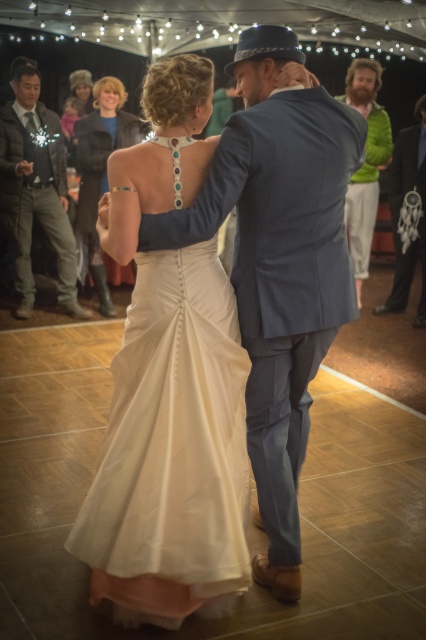
Between point (71, 268) and point (371, 72), which one is positioned behind?

Positioned behind is point (371, 72).

Can you confirm if dark green jacket at left is smaller than green fuzzy sweater at upper right?

Indeed, dark green jacket at left has a smaller size compared to green fuzzy sweater at upper right.

Image resolution: width=426 pixels, height=640 pixels. I want to click on dark green jacket at left, so click(36, 189).

You are a GUI agent. You are given a task and a screenshot of the screen. Output one action in this format:
    pyautogui.click(x=<x>, y=<y>)
    Task: Click on the dark green jacket at left
    
    Given the screenshot: What is the action you would take?
    pyautogui.click(x=36, y=189)

Who is positioned more to the left, ivory satin dress at center or green fuzzy sweater at upper right?

From the viewer's perspective, ivory satin dress at center appears more on the left side.

Is ivory satin dress at center bigger than green fuzzy sweater at upper right?

Actually, ivory satin dress at center might be smaller than green fuzzy sweater at upper right.

Is point (89, 132) more distant than point (367, 141)?

Yes, point (89, 132) is behind point (367, 141).

Identify the location of ivory satin dress at center. This screenshot has height=640, width=426. (100, 172).

Is point (49, 204) closer to viewer compared to point (409, 266)?

Yes, point (49, 204) is closer to viewer.

Between dark green jacket at left and green fabric dreamcatcher at right, which one has more height?

With more height is green fabric dreamcatcher at right.

Who is more distant from viewer, (x=28, y=292) or (x=393, y=224)?

Point (x=393, y=224)

Identify the location of dark green jacket at left. This screenshot has width=426, height=640. (36, 189).